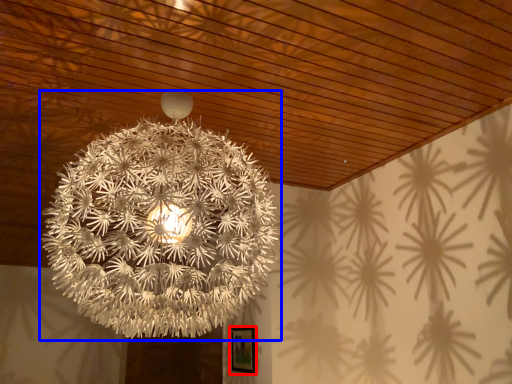
Question: Which of the following is the farthest to the observer, picture frame (highlighted by a red box) or lamp (highlighted by a blue box)?

Choices:
 (A) picture frame
 (B) lamp

Answer: (A)